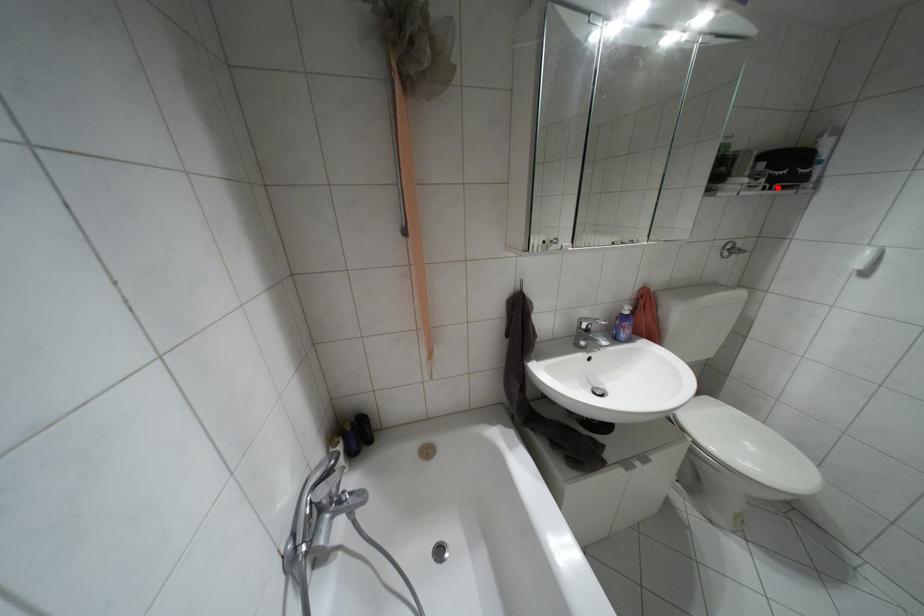
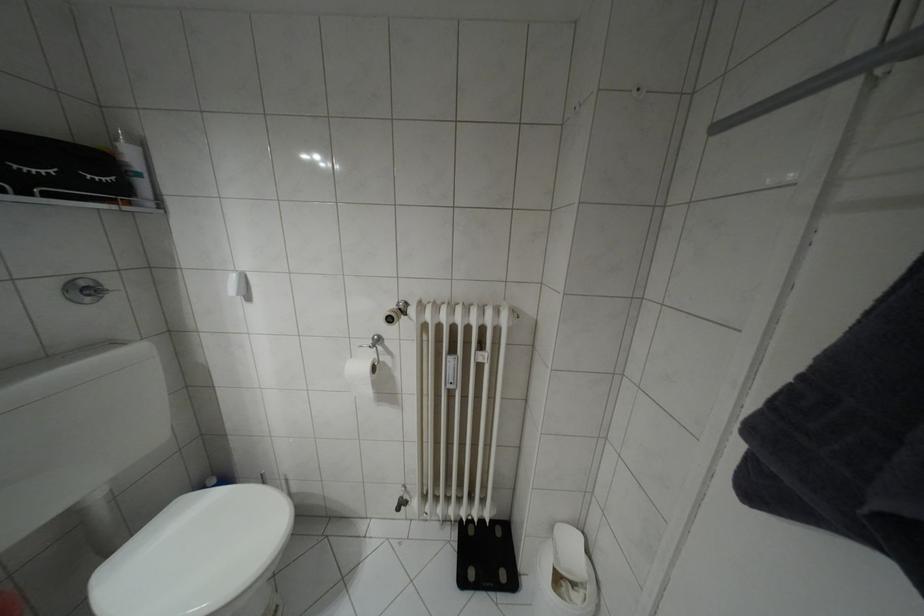
Find the pixel in the second image that matches the highlighted location in the first image.

(49, 195)